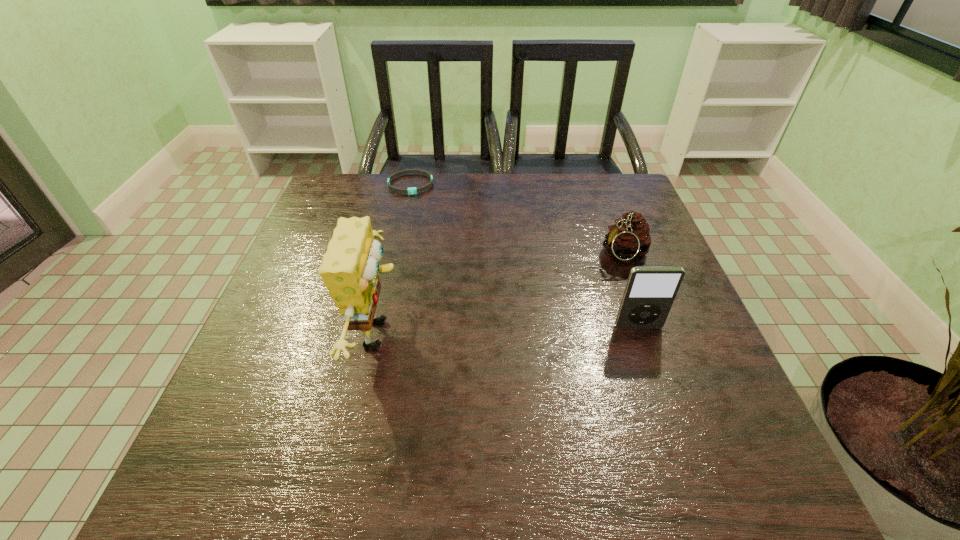
This screenshot has width=960, height=540. I want to click on blank area located 0.400m on the buckle of the farthest object, so (x=455, y=284).

Where is `vacant point located 0.320m with a leaf charm attached to the third nearest object`? The width and height of the screenshot is (960, 540). vacant point located 0.320m with a leaf charm attached to the third nearest object is located at coordinates (505, 325).

What are the coordinates of `vacant space situated with a leaf charm attached to the third nearest object` in the screenshot? It's located at (576, 285).

At what (x,y) coordinates should I click in order to perform the action: click on vacant space situated 0.110m with a leaf charm attached to the third nearest object. Please return your answer as a coordinate pair (x, y). The image size is (960, 540). Looking at the image, I should click on (576, 285).

Image resolution: width=960 pixels, height=540 pixels. In order to click on object at the far edge in this screenshot , I will do `click(413, 190)`.

Identify the location of object that is at the near edge. (350, 270).

This screenshot has width=960, height=540. In order to click on iPod positioned at the right edge in this screenshot , I will do `click(649, 294)`.

Identify the location of pinecone at the right edge. The height and width of the screenshot is (540, 960). (630, 240).

Find the location of a particular element. Image resolution: width=960 pixels, height=540 pixels. vacant space at the far edge of the desktop is located at coordinates (374, 211).

Image resolution: width=960 pixels, height=540 pixels. Find the location of `vacant space at the near edge of the desktop`. vacant space at the near edge of the desktop is located at coordinates (541, 395).